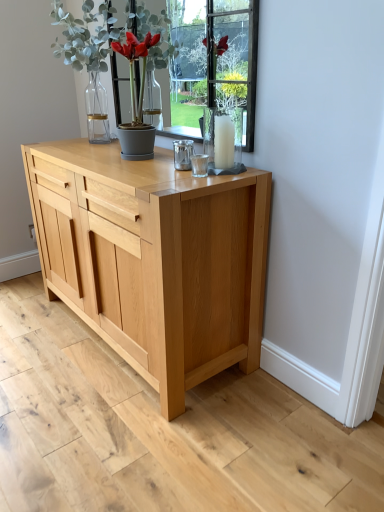
Question: From the image's perspective, would you say clear glass candle at center is positioned over natural wood chest of drawers at center?

Choices:
 (A) yes
 (B) no

Answer: (A)

Question: Does clear glass candle at center have a larger size compared to natural wood chest of drawers at center?

Choices:
 (A) yes
 (B) no

Answer: (B)

Question: Is clear glass candle at center wider than natural wood chest of drawers at center?

Choices:
 (A) yes
 (B) no

Answer: (B)

Question: Is clear glass candle at center oriented away from natural wood chest of drawers at center?

Choices:
 (A) no
 (B) yes

Answer: (A)

Question: Considering the relative sizes of clear glass candle at center and natural wood chest of drawers at center in the image provided, is clear glass candle at center taller than natural wood chest of drawers at center?

Choices:
 (A) no
 (B) yes

Answer: (A)

Question: Is clear glass candle at center in front of or behind green matte plant at upper center in the image?

Choices:
 (A) behind
 (B) front

Answer: (B)

Question: Do you think clear glass candle at center is within green matte plant at upper center, or outside of it?

Choices:
 (A) inside
 (B) outside

Answer: (B)

Question: Considering the positions of point (213, 118) and point (89, 19), is point (213, 118) closer or farther from the camera than point (89, 19)?

Choices:
 (A) closer
 (B) farther

Answer: (A)

Question: Looking at the image, does clear glass candle at center seem bigger or smaller compared to green matte plant at upper center?

Choices:
 (A) small
 (B) big

Answer: (A)

Question: Is natural wood chest of drawers at center taller or shorter than green matte plant at upper center?

Choices:
 (A) short
 (B) tall

Answer: (B)

Question: Based on their sizes in the image, would you say natural wood chest of drawers at center is bigger or smaller than green matte plant at upper center?

Choices:
 (A) small
 (B) big

Answer: (B)

Question: Is natural wood chest of drawers at center in front of or behind green matte plant at upper center in the image?

Choices:
 (A) front
 (B) behind

Answer: (A)

Question: From a real-world perspective, is natural wood chest of drawers at center above or below green matte plant at upper center?

Choices:
 (A) above
 (B) below

Answer: (B)

Question: Which is correct: green matte plant at upper center is inside clear glass candle at center, or outside of it?

Choices:
 (A) inside
 (B) outside

Answer: (B)

Question: Is green matte plant at upper center in front of or behind clear glass candle at center in the image?

Choices:
 (A) front
 (B) behind

Answer: (B)